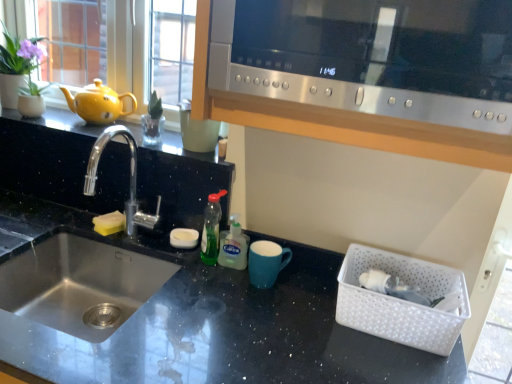
Question: In terms of height, does green matte plant at upper left look taller or shorter compared to green translucent soap dispenser at center, which appears as the 2th bottle when viewed from the left?

Choices:
 (A) tall
 (B) short

Answer: (A)

Question: Based on their sizes in the image, would you say green matte plant at upper left is bigger or smaller than green translucent soap dispenser at center, which appears as the 2th bottle when viewed from the left?

Choices:
 (A) small
 (B) big

Answer: (B)

Question: Which object is the closest to the silver metallic faucet at left?

Choices:
 (A) matte blue mug at center
 (B) green translucent bottle at center, which is counted as the 2th bottle, starting from the right
 (C) black granite countertop at center
 (D) satin silver microwave at upper center
 (E) white plastic basket at lower right

Answer: (C)

Question: Which object is the farthest from the silver metallic faucet at left?

Choices:
 (A) yellow matte teapot at left
 (B) matte blue mug at center
 (C) satin silver microwave at upper center
 (D) yellow sponge at sink
 (E) green translucent bottle at center, the 1th bottle from the left

Answer: (C)